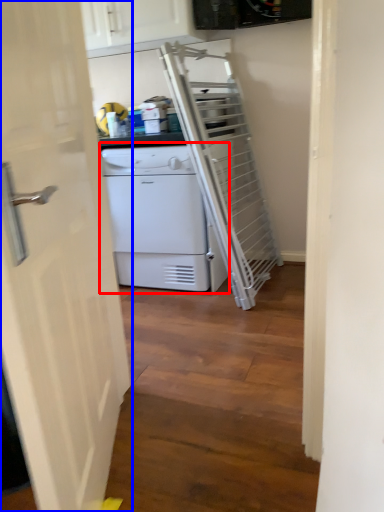
Question: Among these objects, which one is farthest to the camera, home appliance (highlighted by a red box) or door (highlighted by a blue box)?

Choices:
 (A) home appliance
 (B) door

Answer: (A)